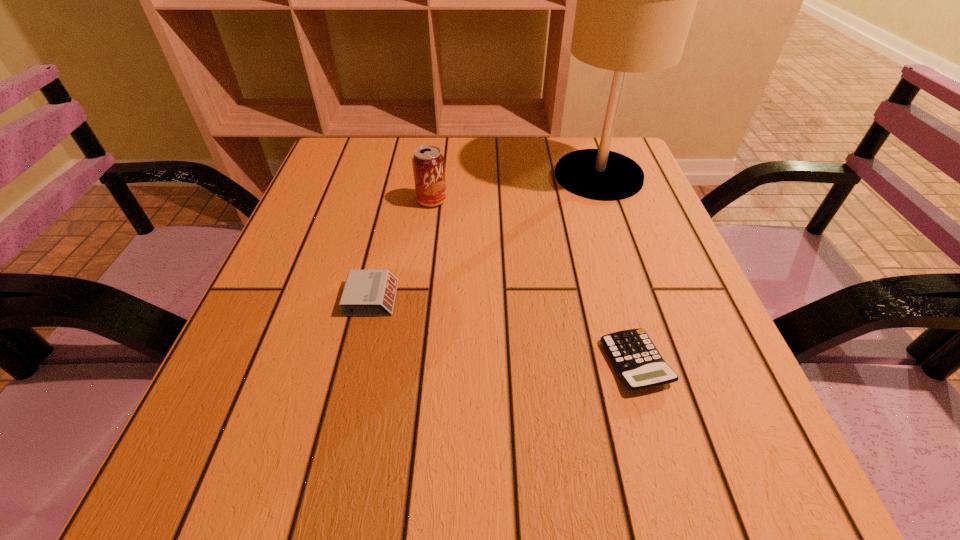
This screenshot has height=540, width=960. I want to click on table lamp, so click(635, 0).

Identify the location of the second object from left to right. tap(428, 164).

Where is `the third shortest object`? This screenshot has height=540, width=960. the third shortest object is located at coordinates (428, 164).

This screenshot has height=540, width=960. Find the location of `the leftmost object`. the leftmost object is located at coordinates (366, 292).

At what (x,y) coordinates should I click in order to perform the action: click on the second nearest object. Please return your answer as a coordinate pair (x, y). Image resolution: width=960 pixels, height=540 pixels. Looking at the image, I should click on (366, 292).

Image resolution: width=960 pixels, height=540 pixels. Identify the location of the nearest object. (637, 361).

Where is `the shortest object`? Image resolution: width=960 pixels, height=540 pixels. the shortest object is located at coordinates (637, 361).

Where is `vacant space located 0.220m on the front of the table lamp`? vacant space located 0.220m on the front of the table lamp is located at coordinates (631, 269).

Locate an element on the screen. blank space located 0.280m on the front of the third shortest object is located at coordinates point(418,304).

The width and height of the screenshot is (960, 540). Identify the location of vacant space situated 0.100m on the back of the third tallest object. (384, 246).